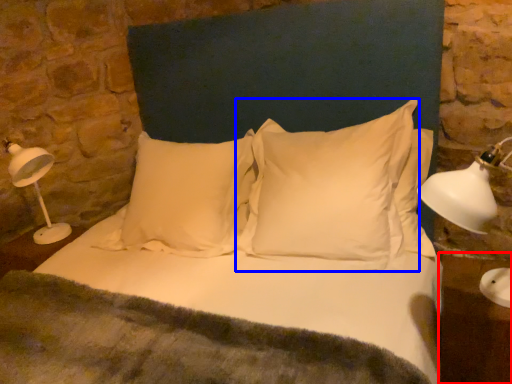
Question: Among these objects, which one is nearest to the camera, table (highlighted by a red box) or pillow (highlighted by a blue box)?

Choices:
 (A) table
 (B) pillow

Answer: (A)